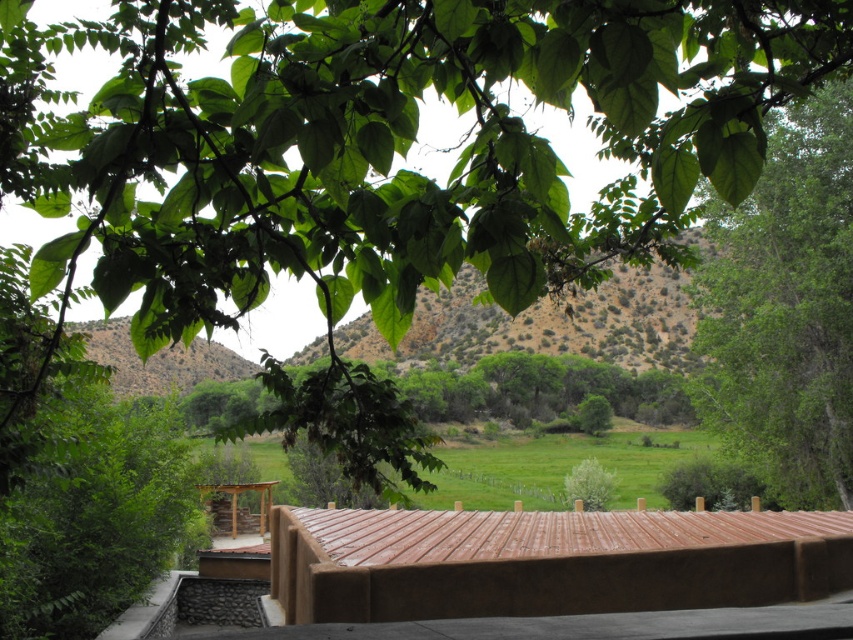
Question: Among these objects, which one is farthest from the camera?

Choices:
 (A) green leafy tree at right
 (B) dull brown hillside at center

Answer: (A)

Question: Estimate the real-world distances between objects in this image. Which object is farther from the brown corrugated metal roof at center?

Choices:
 (A) dull brown hillside at center
 (B) green leafy tree at right

Answer: (A)

Question: Is green leafy tree at right to the left of dull brown hillside at center from the viewer's perspective?

Choices:
 (A) yes
 (B) no

Answer: (B)

Question: Which point is closer to the camera?

Choices:
 (A) green leafy tree at right
 (B) dull brown hillside at center

Answer: (B)

Question: Can you confirm if brown corrugated metal roof at center is positioned to the right of dull brown hillside at center?

Choices:
 (A) no
 (B) yes

Answer: (A)

Question: Does brown corrugated metal roof at center appear on the left side of green leafy tree at right?

Choices:
 (A) no
 (B) yes

Answer: (B)